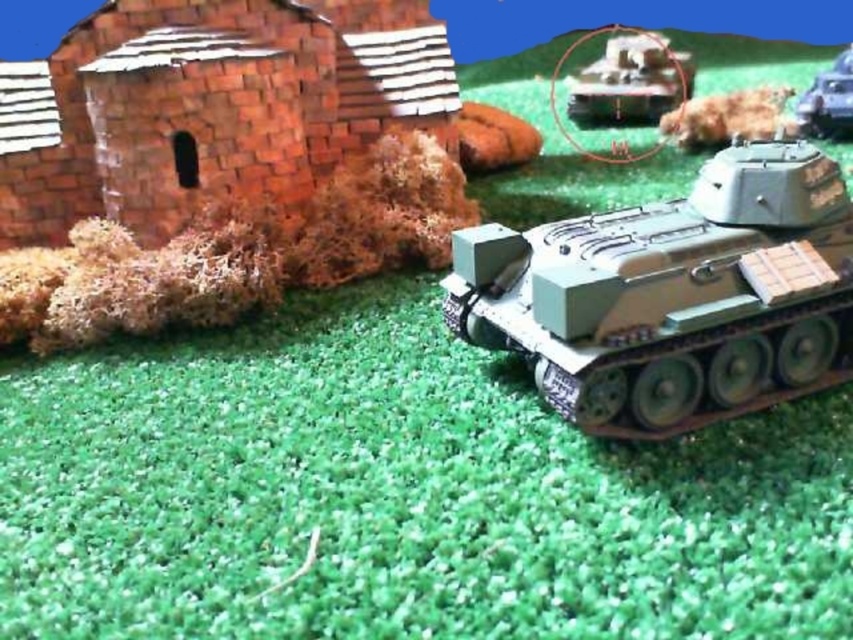
You are observing a miniature diorama scene with a military tank and a small brick building. There are two points marked in the scene at coordinates point (728, 129) and point (824, 96). From your perspective, which of these two points is nearer to you?

Point (728, 129) is closer to the camera than point (824, 96).

You are a collector who wants to place a new 3D printed model of a soldier between the brown fur dog at upper center and the matte green tank at center in the diorama. The soldier model is 2.5 inches wide. Will there be enough space between them to fit the soldier without overlapping either the dog or the tank?

The distance between the brown fur dog at upper center and the matte green tank at center is 7.81 inches. Since the soldier model is only 2.5 inches wide, there is sufficient space to place it between them without overlapping either object.

You are a model soldier positioned at the origin point in the diorama. You need to reach the camouflage plastic tank at lower right. What are the coordinates of the tank to navigate towards?

The camouflage plastic tank at lower right is located at coordinates point (672,296).